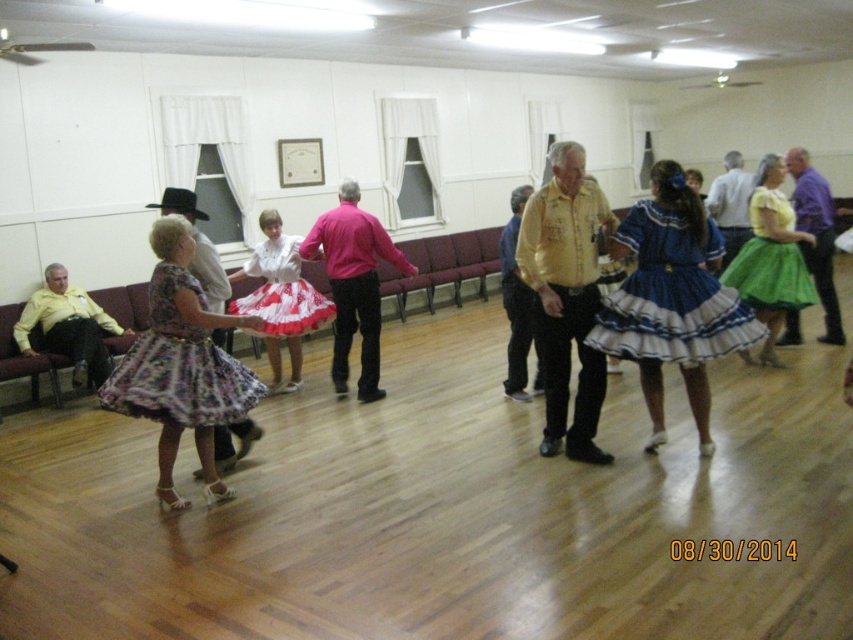
You are organizing a dance event and need to arrange seating for participants. The blue satin dress at center and the purple cotton shirt at center are both in the center of the room. Which one requires more space for seating?

The blue satin dress at center is wider than the purple cotton shirt at center, so it requires more space for seating.

Consider the image. You are a photographer positioned at the entrance of the hall. You need to capture a photo of both the yellow cotton shirt at center and the matte yellow shirt at center. Which one should you adjust your camera to focus on first if you want to capture them from left to right in the frame?

You should focus on the yellow cotton shirt at center first because it is positioned to the left of the matte yellow shirt at center, so capturing them from left to right would require starting with the one on the left.